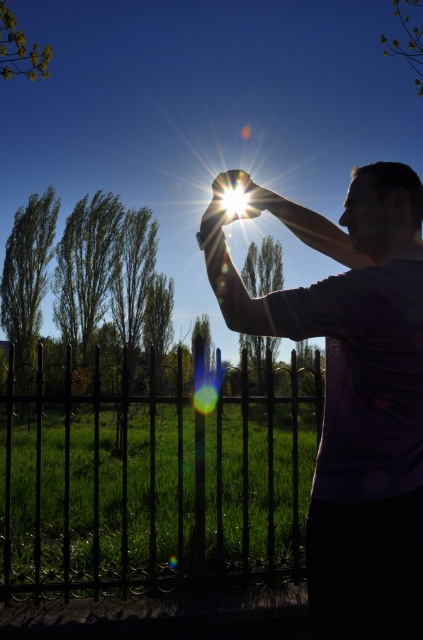
You are standing in the scene and want to find the point at coordinates (19,49). Where should you look?

The point at coordinates (19,49) is located on the green leafy tree at upper left.

You are standing in the scene and want to take a photo of the green leafy tree at left. Where should you position yourself relative to the point marked at coordinates point [27,280] to capture it in the frame?

The green leafy tree at left is located at point [27,280], so you should position yourself directly at that point to capture it in the frame.

You are a photographer wanting to capture the sunset with both the green leafy tree at left and the green leafy tree at upper right in the frame. Which tree should you position closer to the camera to ensure both are fully visible in the shot?

You should position the green leafy tree at left closer to the camera because it is shorter than the green leafy tree at upper right, allowing both trees to be fully visible in the frame.